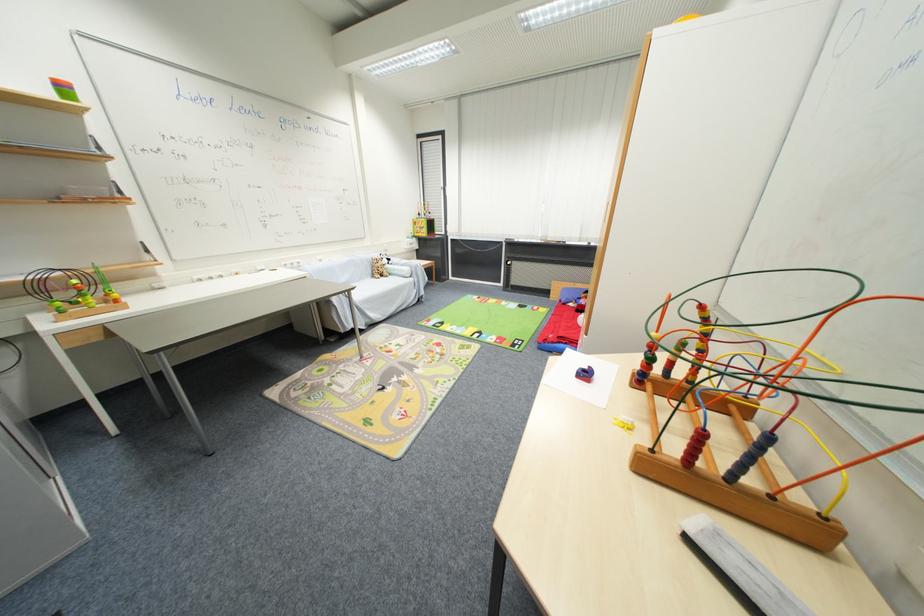
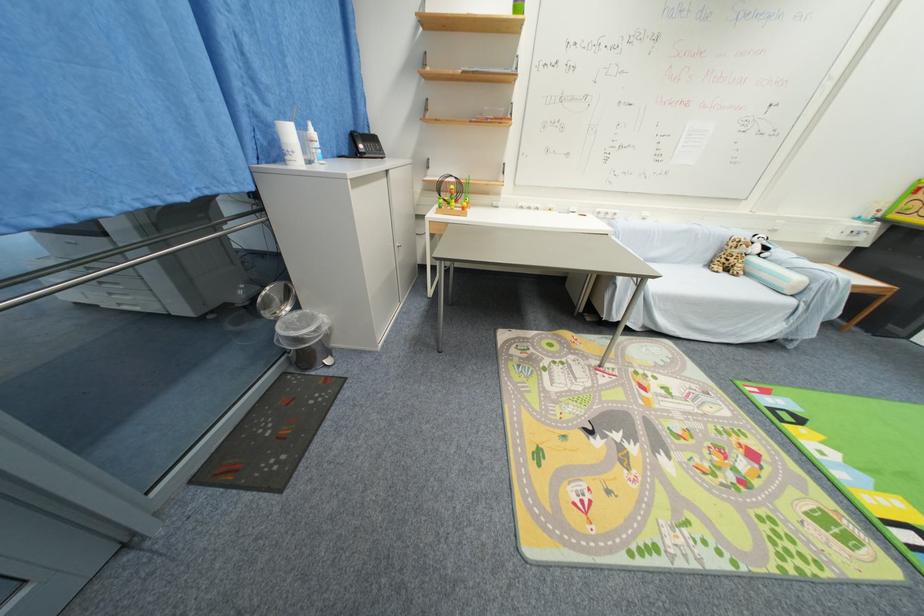
Where in the second image is the point corresponding to the point at 391,262 from the first image?

(761, 251)